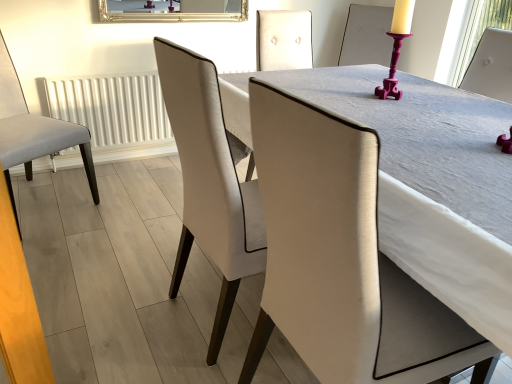
Question: From a real-world perspective, is gold-framed mirror at upper center over white textured radiator at left?

Choices:
 (A) yes
 (B) no

Answer: (A)

Question: Would you say white textured radiator at left is part of gold-framed mirror at upper center's contents?

Choices:
 (A) yes
 (B) no

Answer: (B)

Question: From the image's perspective, is gold-framed mirror at upper center on top of white textured radiator at left?

Choices:
 (A) no
 (B) yes

Answer: (B)

Question: From the image's perspective, is gold-framed mirror at upper center beneath white textured radiator at left?

Choices:
 (A) no
 (B) yes

Answer: (A)

Question: Considering the relative positions of gold-framed mirror at upper center and white textured radiator at left in the image provided, is gold-framed mirror at upper center in front of white textured radiator at left?

Choices:
 (A) no
 (B) yes

Answer: (B)

Question: Would you say white textured radiator at left is inside or outside matte white chair at center, which is the 2th chair in left-to-right order?

Choices:
 (A) inside
 (B) outside

Answer: (B)

Question: Is point (98, 157) positioned closer to the camera than point (487, 165)?

Choices:
 (A) farther
 (B) closer

Answer: (A)

Question: Considering the positions of white textured radiator at left and matte white chair at center, which ranks as the 1th chair in right-to-left order, in the image, is white textured radiator at left wider or thinner than matte white chair at center, which ranks as the 1th chair in right-to-left order,?

Choices:
 (A) thin
 (B) wide

Answer: (A)

Question: Relative to matte white chair at center, which is the 2th chair in left-to-right order, is white textured radiator at left in front or behind?

Choices:
 (A) front
 (B) behind

Answer: (B)

Question: Does point pos(59,135) appear closer or farther from the camera than point pos(393,365)?

Choices:
 (A) farther
 (B) closer

Answer: (A)

Question: Do you think light gray fabric chair at left, the first chair viewed from the left, is within matte white chair at center, which is the 2th chair in left-to-right order, or outside of it?

Choices:
 (A) outside
 (B) inside

Answer: (A)

Question: From a real-world perspective, is light gray fabric chair at left, the first chair viewed from the left, above or below matte white chair at center, which is the 2th chair in left-to-right order?

Choices:
 (A) below
 (B) above

Answer: (B)

Question: Considering the positions of light gray fabric chair at left, the first chair viewed from the left, and matte white chair at center, which is the 2th chair in left-to-right order, in the image, is light gray fabric chair at left, the first chair viewed from the left, bigger or smaller than matte white chair at center, which is the 2th chair in left-to-right order,?

Choices:
 (A) small
 (B) big

Answer: (A)

Question: From their relative heights in the image, would you say gold-framed mirror at upper center is taller or shorter than white textured radiator at left?

Choices:
 (A) tall
 (B) short

Answer: (B)

Question: Considering the relative positions of gold-framed mirror at upper center and white textured radiator at left in the image provided, is gold-framed mirror at upper center to the left or to the right of white textured radiator at left?

Choices:
 (A) left
 (B) right

Answer: (B)